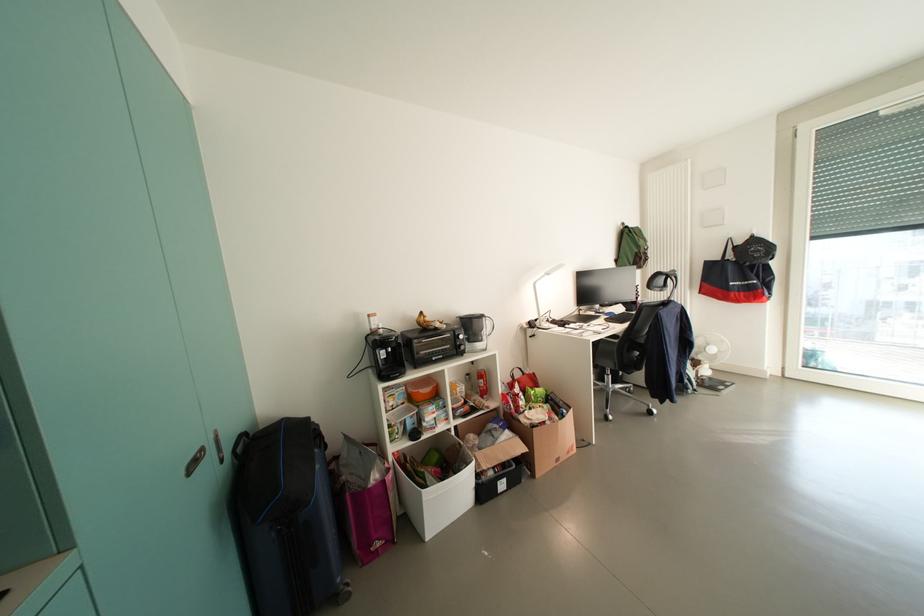
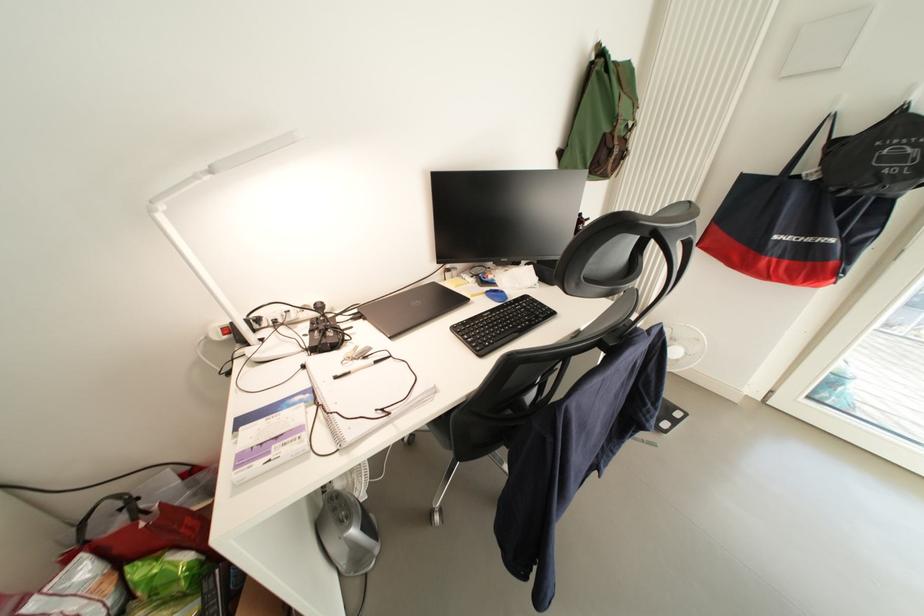
Where in the second image is the point corresponding to the point at 728,391 from the first image?

(673, 428)